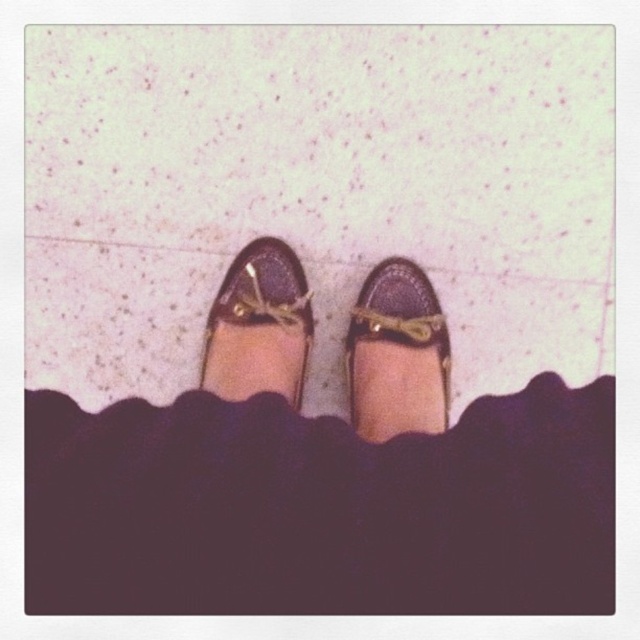
Question: Does matte brown loafer at center have a larger size compared to matte brown leather shoe at center?

Choices:
 (A) no
 (B) yes

Answer: (A)

Question: Which object is positioned closest to the shiny brown shoes at center?

Choices:
 (A) matte brown loafer at center
 (B) matte brown leather shoe at center

Answer: (A)

Question: Estimate the real-world distances between objects in this image. Which object is closer to the shiny brown shoes at center?

Choices:
 (A) matte brown loafer at center
 (B) matte brown leather shoe at center

Answer: (A)

Question: Is shiny brown shoes at center thinner than matte brown loafer at center?

Choices:
 (A) yes
 (B) no

Answer: (B)

Question: Which point is farther to the camera?

Choices:
 (A) matte brown loafer at center
 (B) matte brown leather shoe at center
 (C) shiny brown shoes at center

Answer: (A)

Question: Does shiny brown shoes at center lie in front of matte brown loafer at center?

Choices:
 (A) no
 (B) yes

Answer: (B)